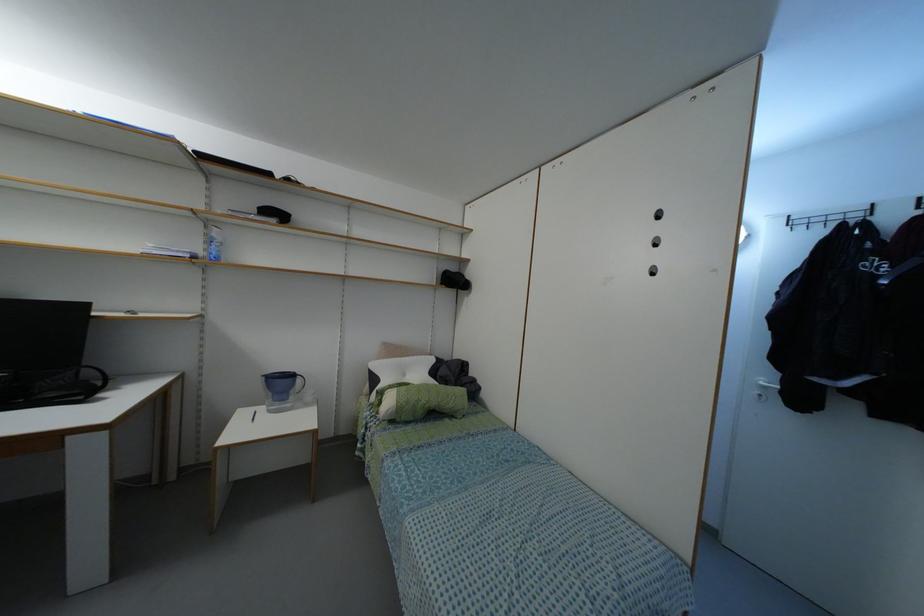
Find where to lift the blue pitcher handle. Please return your answer as a coordinate pair (x, y).

(299, 385)